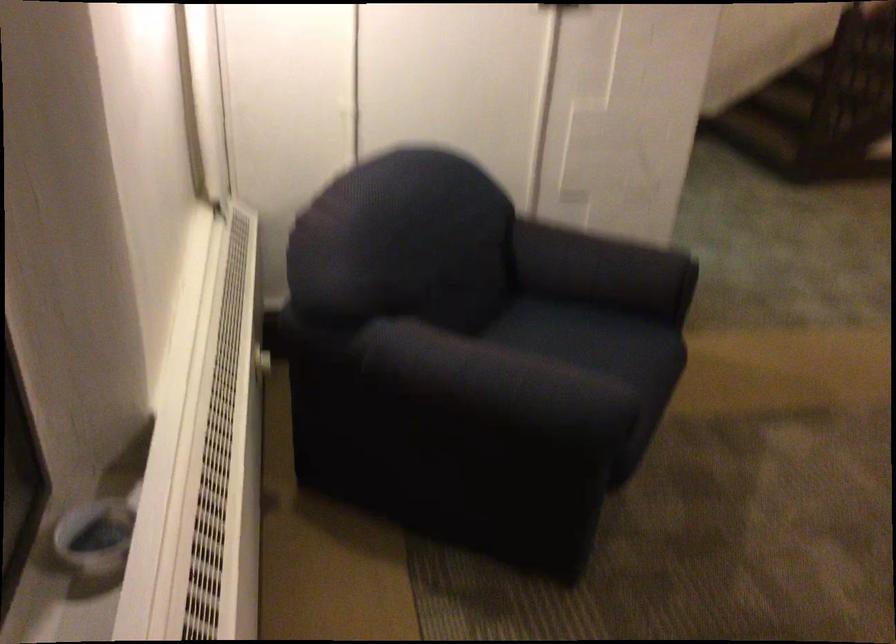
Question: The images are taken continuously from a first-person perspective. In which direction is your viewpoint rotating?

Choices:
 (A) Left
 (B) Right
 (C) Up
 (D) Down

Answer: (B)